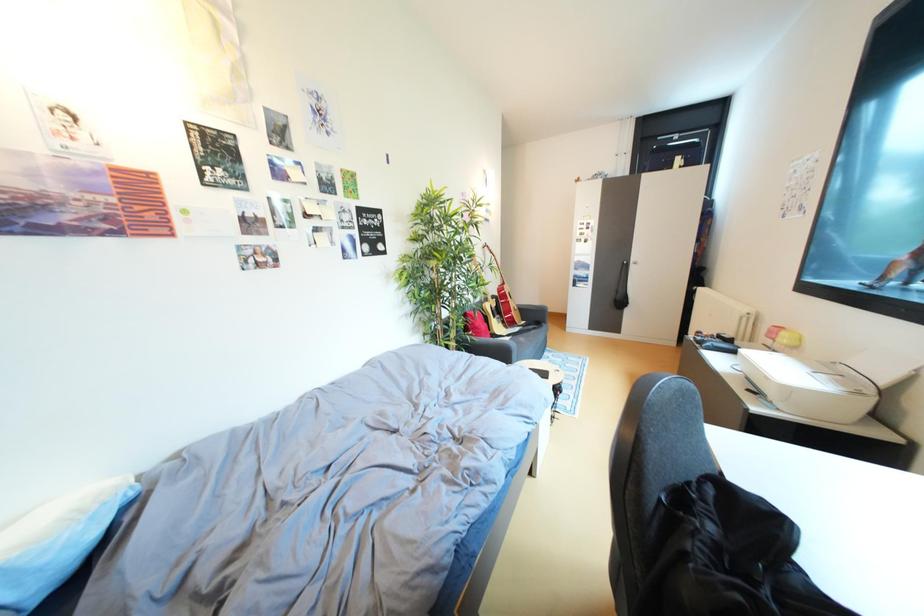
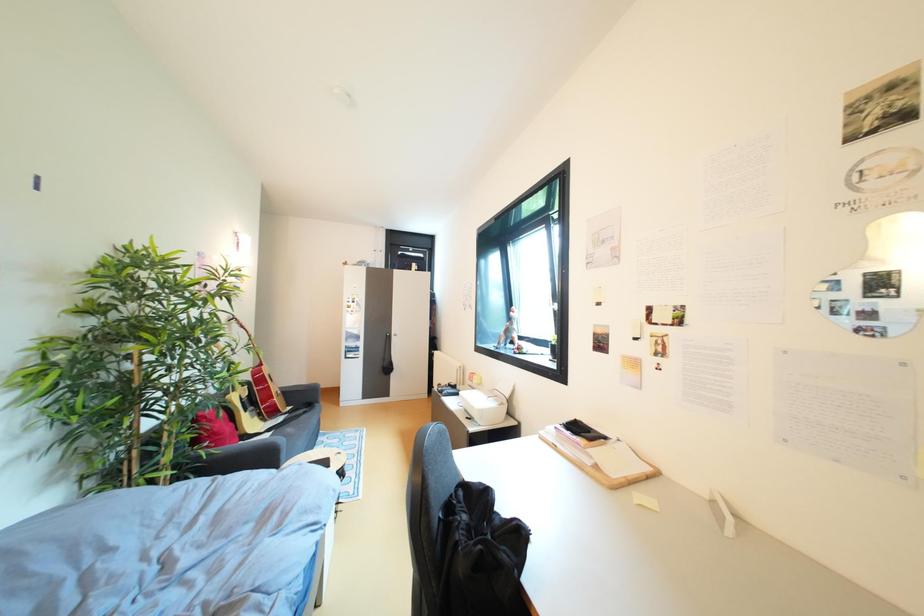
Question: The camera is either moving clockwise (left) or counter-clockwise (right) around the object. The first image is from the beginning of the video and the second image is from the end. Is the camera moving left or right when shooting the video?

Choices:
 (A) Left
 (B) Right

Answer: (A)